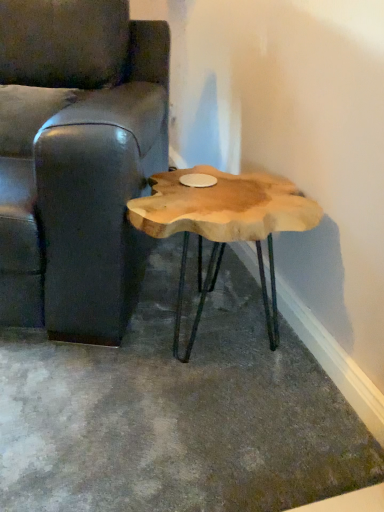
What are the coordinates of `free point above natural wood coffee table at center (from a real-world perspective)` in the screenshot? It's located at (212, 193).